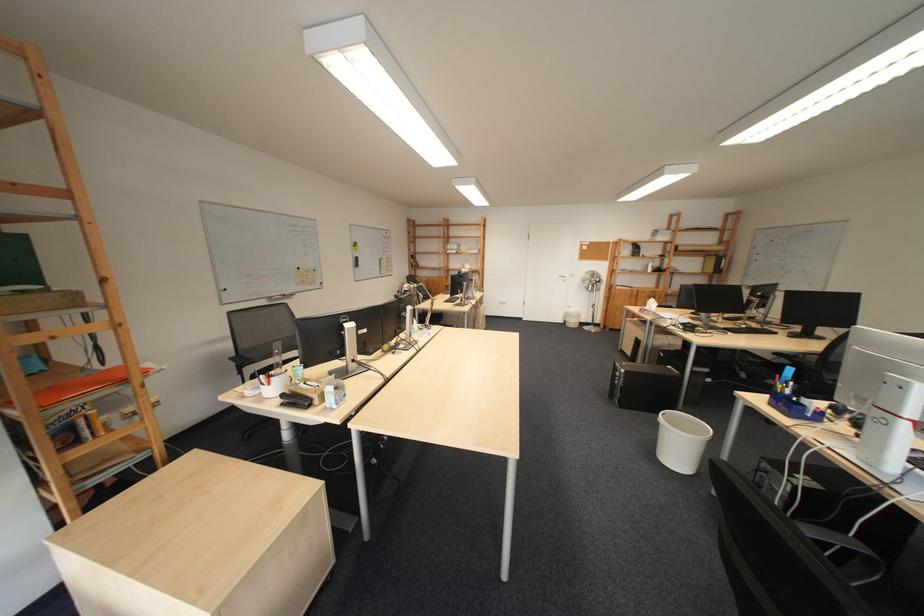
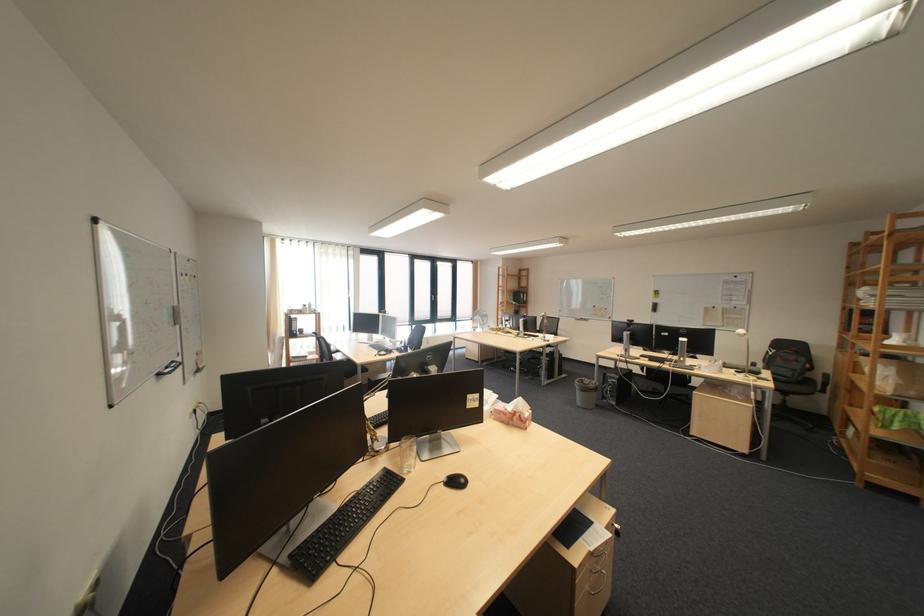
The point at (312, 270) is marked in the first image. Where is the corresponding point in the second image?

(609, 308)